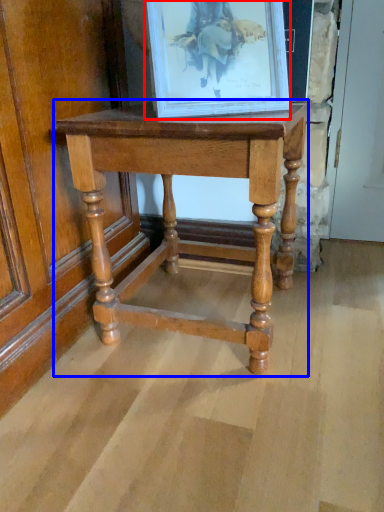
Question: Which object is closer to the camera taking this photo, picture frame (highlighted by a red box) or table (highlighted by a blue box)?

Choices:
 (A) picture frame
 (B) table

Answer: (A)